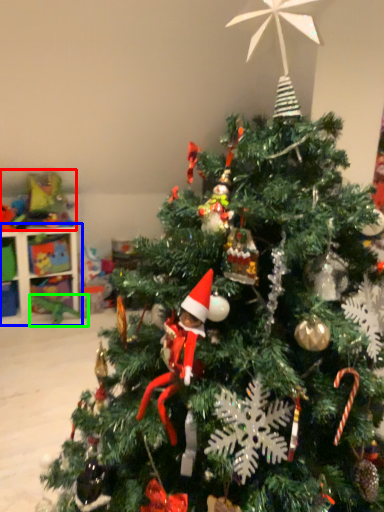
Question: Which object is the farthest from toy (highlighted by a red box)? Choose among these: shelf (highlighted by a blue box) or toy (highlighted by a green box).

Choices:
 (A) shelf
 (B) toy

Answer: (B)